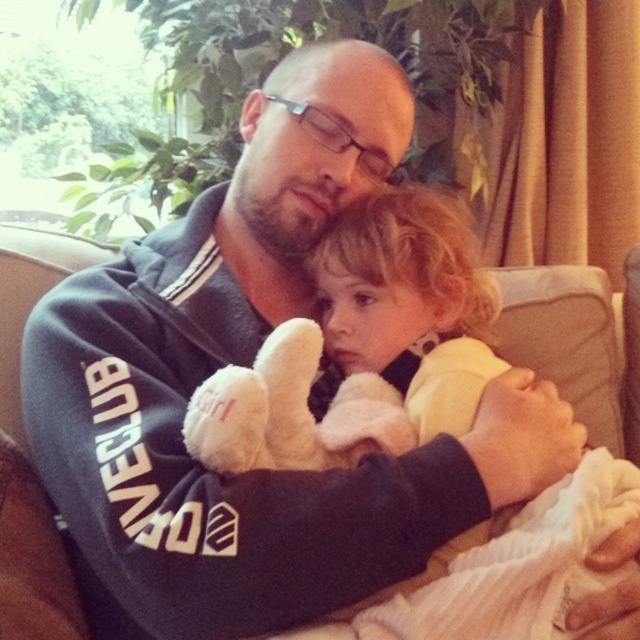
You are a photographer trying to capture the child holding both the soft white teddy bear at center and the white plush toy at center. Since both items are at the center, how can you determine which one is on the right side of the other?

The soft white teddy bear at center is to the right of the white plush toy at center, so the teddy bear is on the right side of the plush toy.

You are designing a small gift box that needs to fit both the soft white teddy bear at center and the white plush toy at center. Based on their sizes, which one requires a larger box in terms of width?

The soft white teddy bear at center might be wider than the white plush toy at center, so the teddy bear likely needs a larger box in terms of width.

In the scene shown: You are taking a photo of the scene and want to focus on both the adult and the child. Based on their positions at point coordinates point (394, 257) and point (296, 371), which point is closer to your camera lens?

Point (296, 371) is closer to the camera lens because the description states that point (394, 257) is further away from the camera than point (296, 371).